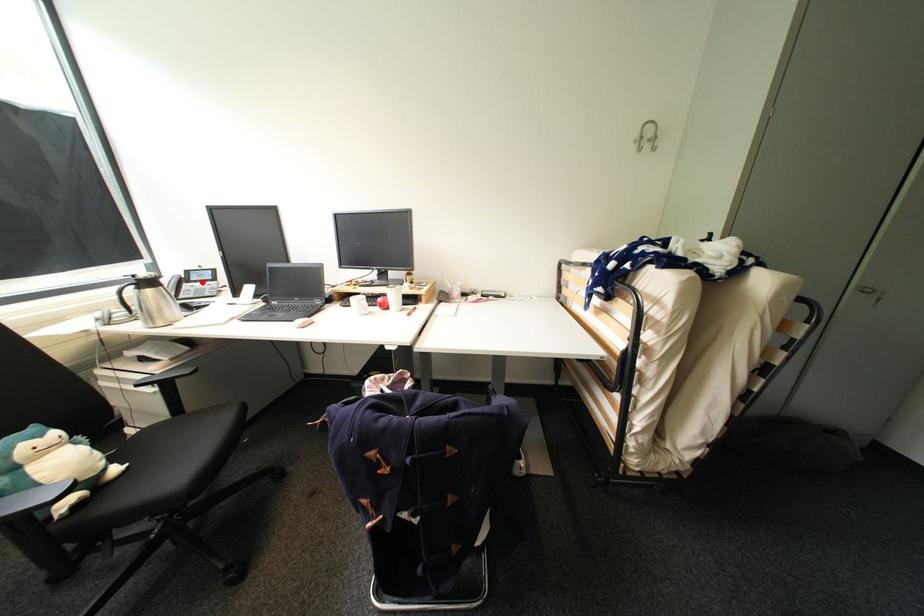
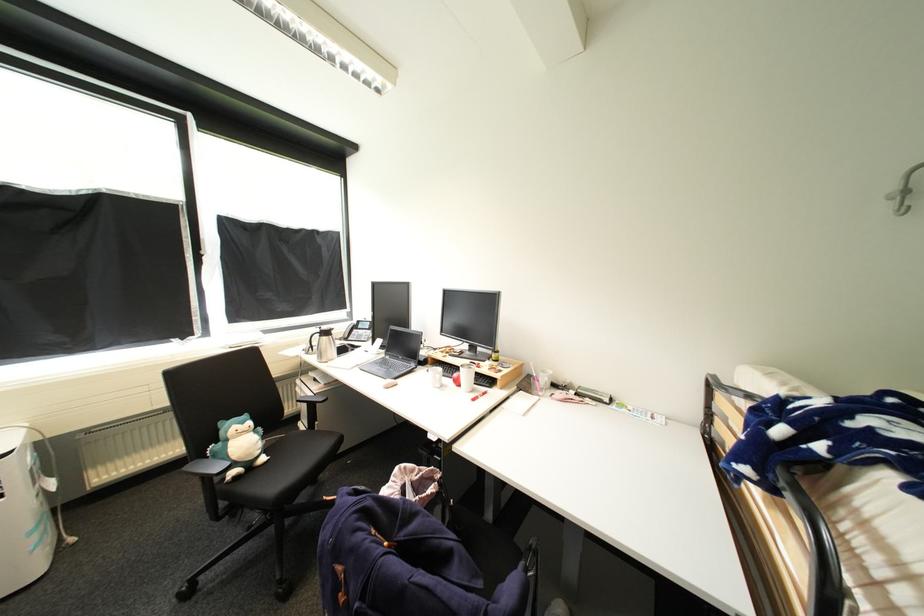
Question: I am providing you with two images of the same scene from different viewpoints. In image1, a red point is highlighted. Considering the same 3D point in image2, which of the following is correct?

Choices:
 (A) It is closer
 (B) It is farther

Answer: (B)